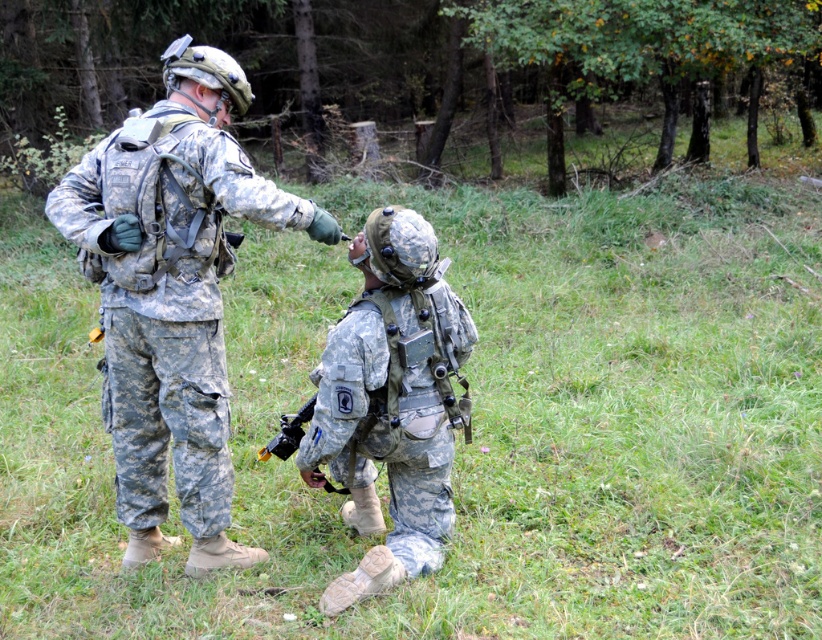
Question: Considering the real-world distances, which object is closest to the matte black rifle at lower center?

Choices:
 (A) camouflage fabric uniform at center
 (B) camouflage fabric helmet at center
 (C) matte black rifle at center

Answer: (C)

Question: Where is camouflage fabric uniform at center located in relation to camouflage fabric helmet at center in the image?

Choices:
 (A) left
 (B) right

Answer: (A)

Question: Can you confirm if camouflage fabric helmet at center is positioned above matte black rifle at center?

Choices:
 (A) no
 (B) yes

Answer: (B)

Question: Based on their relative distances, which object is farther from the matte black rifle at center?

Choices:
 (A) matte black rifle at lower center
 (B) camouflage fabric uniform at center

Answer: (B)

Question: Can you confirm if camouflage fabric uniform at center is smaller than matte black rifle at center?

Choices:
 (A) yes
 (B) no

Answer: (B)

Question: Which point is farther to the camera?

Choices:
 (A) camouflage fabric helmet at center
 (B) matte black rifle at lower center
 (C) camouflage fabric uniform at center

Answer: (B)